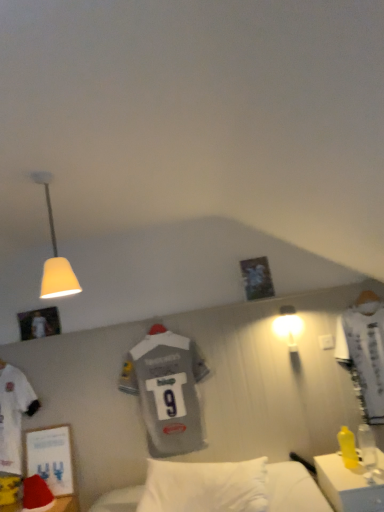
In order to click on gray jersey at center in this screenshot , I will do `click(167, 391)`.

Locate an element on the screen. The width and height of the screenshot is (384, 512). t shirt located on the right of matte white lampshade at upper left, which is the 1th lamp from top to bottom is located at coordinates (167, 391).

Based on the photo, which object is thinner, matte white lampshade at upper left, which is the 1th lamp from top to bottom, or gray jersey at center?

gray jersey at center.

In terms of height, does matte white lampshade at upper left, which is the 2th lamp in bottom-to-top order, look taller or shorter compared to gray jersey at center?

matte white lampshade at upper left, which is the 2th lamp in bottom-to-top order, is shorter than gray jersey at center.

Between point (172, 433) and point (49, 204), which one is positioned behind?

The point (172, 433) is more distant.

Who is bigger, gray jersey at center or matte white lampshade at upper left, the second lamp positioned from the right?

With larger size is gray jersey at center.

Considering the sizes of objects gray jersey at center and matte white lampshade at upper left, the second lamp positioned from the right, in the image provided, who is taller, gray jersey at center or matte white lampshade at upper left, the second lamp positioned from the right,?

With more height is gray jersey at center.

Based on the photo, based on their positions, is gray jersey at center located to the left or right of matte white lampshade at upper left, the second lamp positioned from the right?

In the image, gray jersey at center appears on the right side of matte white lampshade at upper left, the second lamp positioned from the right.

Is yellow plastic desk at lower right wider than matte white bulb at upper right, the 1th lamp ordered from the bottom?

Correct, the width of yellow plastic desk at lower right exceeds that of matte white bulb at upper right, the 1th lamp ordered from the bottom.

Who is smaller, yellow plastic desk at lower right or matte white bulb at upper right, the first lamp from the right?

Smaller between the two is matte white bulb at upper right, the first lamp from the right.

Between yellow plastic desk at lower right and matte white bulb at upper right, the 2th lamp positioned from the left, which one has more height?

Standing taller between the two is yellow plastic desk at lower right.

Is yellow plastic desk at lower right aimed at matte white bulb at upper right, the 1th lamp ordered from the bottom?

No, yellow plastic desk at lower right is not oriented towards matte white bulb at upper right, the 1th lamp ordered from the bottom.

Which is less distant, (291, 346) or (68, 278)?

The point (68, 278) is closer to the camera.

Consider the image. From the image's perspective, would you say matte white bulb at upper right, the 1th lamp ordered from the bottom, is positioned over matte white lampshade at upper left, placed as the 1th lamp when sorted from left to right?

Actually, matte white bulb at upper right, the 1th lamp ordered from the bottom, appears below matte white lampshade at upper left, placed as the 1th lamp when sorted from left to right, in the image.

Would you say matte white bulb at upper right, positioned as the second lamp in front-to-back order, is to the left or to the right of matte white lampshade at upper left, the second lamp positioned from the right, in the picture?

matte white bulb at upper right, positioned as the second lamp in front-to-back order, is positioned on matte white lampshade at upper left, the second lamp positioned from the right,'s right side.

Which object is wider, matte white lampshade at upper left, marked as the 1th lamp in a front-to-back arrangement, or matte white bulb at upper right, positioned as the second lamp in front-to-back order?

With larger width is matte white lampshade at upper left, marked as the 1th lamp in a front-to-back arrangement.

This screenshot has width=384, height=512. In order to click on lamp located above the matte white bulb at upper right, the 2th lamp in the top-to-bottom sequence (from a real-world perspective) in this screenshot , I will do `click(55, 255)`.

From a real-world perspective, is matte white lampshade at upper left, which is the 1th lamp from top to bottom, over matte white bulb at upper right, the 2th lamp in the top-to-bottom sequence?

Yes, from a real-world perspective, matte white lampshade at upper left, which is the 1th lamp from top to bottom, is on top of matte white bulb at upper right, the 2th lamp in the top-to-bottom sequence.

How different are the orientations of matte white lampshade at upper left, which is the 1th lamp from top to bottom, and matte white bulb at upper right, the first lamp from the right, in degrees?

The angular difference between matte white lampshade at upper left, which is the 1th lamp from top to bottom, and matte white bulb at upper right, the first lamp from the right, is 1.39 degrees.

From the image's perspective, would you say gray jersey at center is positioned over matte white bulb at upper right, the 2th lamp in the top-to-bottom sequence?

No, from the image's perspective, gray jersey at center is not over matte white bulb at upper right, the 2th lamp in the top-to-bottom sequence.

Looking at their sizes, would you say gray jersey at center is wider or thinner than matte white bulb at upper right, the 2th lamp in the top-to-bottom sequence?

Considering their sizes, gray jersey at center looks slimmer than matte white bulb at upper right, the 2th lamp in the top-to-bottom sequence.

Consider the image. Could you tell me if gray jersey at center is facing matte white bulb at upper right, positioned as the second lamp in front-to-back order?

No, gray jersey at center is not facing towards matte white bulb at upper right, positioned as the second lamp in front-to-back order.

Considering the relative sizes of matte white bulb at upper right, positioned as the second lamp in front-to-back order, and yellow plastic desk at lower right in the image provided, is matte white bulb at upper right, positioned as the second lamp in front-to-back order, wider than yellow plastic desk at lower right?

No, matte white bulb at upper right, positioned as the second lamp in front-to-back order, is not wider than yellow plastic desk at lower right.

How distant is matte white bulb at upper right, the first lamp from the right, from yellow plastic desk at lower right?

matte white bulb at upper right, the first lamp from the right, is 35.24 inches away from yellow plastic desk at lower right.

From the image's perspective, which one is positioned higher, matte white bulb at upper right, the 2th lamp positioned from the left, or yellow plastic desk at lower right?

matte white bulb at upper right, the 2th lamp positioned from the left, appears higher in the image.

In order to click on t shirt behind the matte white lampshade at upper left, placed as the 1th lamp when sorted from left to right in this screenshot , I will do `click(167, 391)`.

I want to click on lamp that is the 2nd object located above the gray jersey at center (from the image's perspective), so click(x=55, y=255).

Looking at this image, from the image, which object appears to be farther from matte white bulb at upper right, the 2th lamp in the top-to-bottom sequence, gray jersey at center or matte white lampshade at upper left, marked as the 1th lamp in a front-to-back arrangement?

matte white lampshade at upper left, marked as the 1th lamp in a front-to-back arrangement.

Based on their spatial positions, is yellow plastic desk at lower right or gray jersey at center closer to matte white lampshade at upper left, the second lamp positioned from the right?

Based on the image, gray jersey at center appears to be nearer to matte white lampshade at upper left, the second lamp positioned from the right.

Based on the photo, from the image, which object appears to be farther from yellow plastic desk at lower right, gray jersey at center or matte white bulb at upper right, the 2th lamp in the top-to-bottom sequence?

gray jersey at center.

Based on their spatial positions, is matte white lampshade at upper left, which is the 1th lamp from top to bottom, or gray jersey at center closer to yellow plastic desk at lower right?

Based on the image, gray jersey at center appears to be nearer to yellow plastic desk at lower right.

Estimate the real-world distances between objects in this image. Which object is closer to matte white bulb at upper right, the 2th lamp in the top-to-bottom sequence, yellow plastic desk at lower right or gray jersey at center?

Among the two, gray jersey at center is located nearer to matte white bulb at upper right, the 2th lamp in the top-to-bottom sequence.

Looking at the image, which one is located further to matte white bulb at upper right, the 1th lamp ordered from the bottom, gray jersey at center or yellow plastic desk at lower right?

yellow plastic desk at lower right lies further to matte white bulb at upper right, the 1th lamp ordered from the bottom, than the other object.

Based on their spatial positions, is matte white lampshade at upper left, the second lamp positioned from the right, or gray jersey at center closer to matte white bulb at upper right, the first lamp from the right?

gray jersey at center is closer to matte white bulb at upper right, the first lamp from the right.

Estimate the real-world distances between objects in this image. Which object is further from matte white lampshade at upper left, placed as the 1th lamp when sorted from left to right, matte white bulb at upper right, positioned as the second lamp in front-to-back order, or yellow plastic desk at lower right?

yellow plastic desk at lower right.

This screenshot has width=384, height=512. Find the location of `lamp between gray jersey at center and yellow plastic desk at lower right`. lamp between gray jersey at center and yellow plastic desk at lower right is located at coordinates (288, 326).

Identify the location of lamp between matte white lampshade at upper left, the second lamp positioned from the right, and yellow plastic desk at lower right from left to right. (288, 326).

Identify the location of t shirt between matte white lampshade at upper left, which is the 2th lamp in bottom-to-top order, and yellow plastic desk at lower right from left to right. (167, 391).

Where is `lamp positioned between matte white lampshade at upper left, the second lamp positioned from the right, and gray jersey at center from near to far`? This screenshot has height=512, width=384. lamp positioned between matte white lampshade at upper left, the second lamp positioned from the right, and gray jersey at center from near to far is located at coordinates (288, 326).